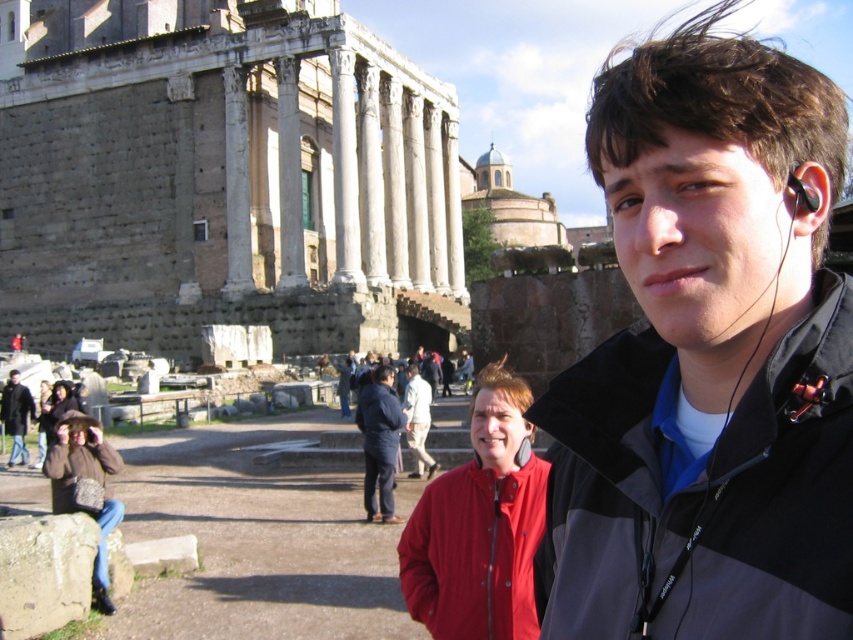
You are standing at the point marked by the coordinates (474, 550) in the image of the ancient Roman site. What color is the jacket of the person closest to you?

The point (474, 550) indicates the location of the matte red jacket at center, so the closest person to this point is wearing a matte red jacket.

Looking at this image, you are standing at the ancient Roman site and want to take a photo of the point at coordinates point (366, 45). Your camera has a maximum focus range of 75 meters. Will you be able to focus on the point?

The point (366, 45) is 76.06 meters away from the camera, which exceeds the maximum focus range of 75 meters. Therefore, the camera will not be able to focus on the point.